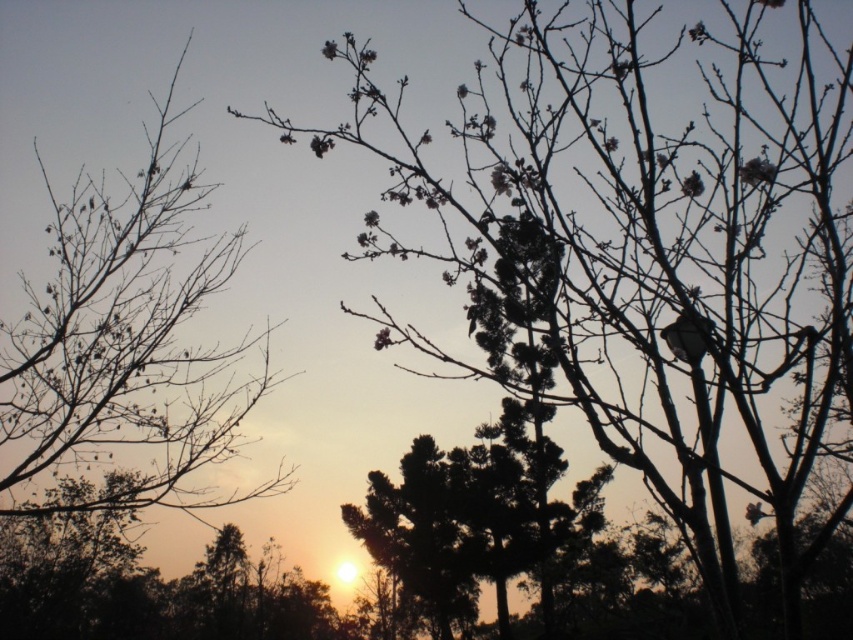
Question: Does silvery branches at center appear over silhouette bark tree at left?

Choices:
 (A) yes
 (B) no

Answer: (A)

Question: Is silvery branches at center wider than silhouette bark tree at left?

Choices:
 (A) yes
 (B) no

Answer: (A)

Question: Which of the following is the closest to the observer?

Choices:
 (A) silvery branches at center
 (B) silhouette bark tree at left

Answer: (A)

Question: Which object appears closest to the camera in this image?

Choices:
 (A) silhouette bark tree at left
 (B) silvery branches at center

Answer: (B)

Question: Among these objects, which one is nearest to the camera?

Choices:
 (A) silvery branches at center
 (B) silhouette bark tree at left

Answer: (A)

Question: Does silvery branches at center have a lesser width compared to silhouette bark tree at left?

Choices:
 (A) yes
 (B) no

Answer: (B)